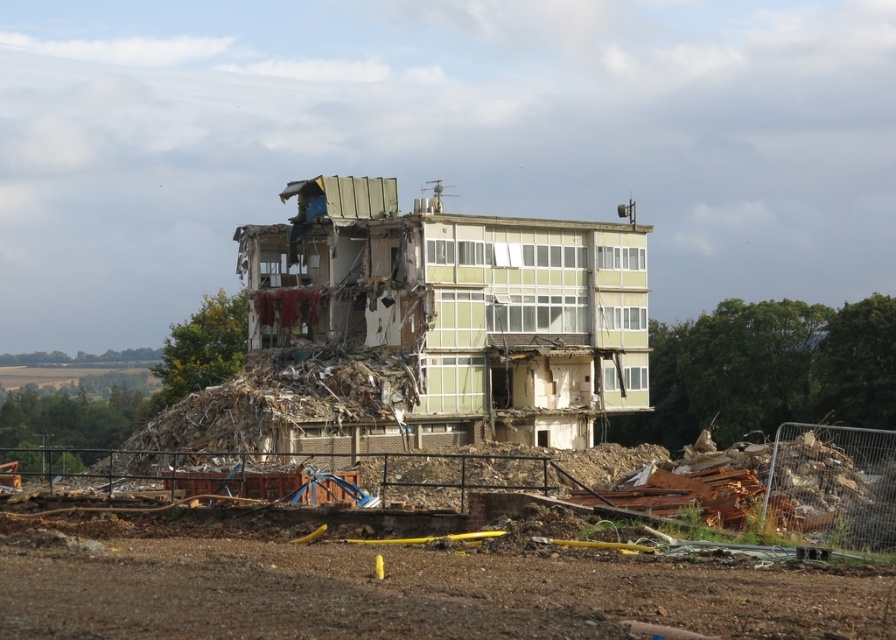
You are standing outside the demolition site and want to safely observe the green concrete building at center from a distance. According to safety guidelines, you must stay at least 20 meters away from any demolition site to avoid falling debris. Are you currently within the safe distance?

The green concrete building at center and viewer are 16.44 meters apart. Since the required safe distance is 20 meters, you are currently 3.56 meters too close and need to move back further to ensure safety.

You are standing at the demolition site and want to retrieve the rusty metal debris at center for recycling. Considering safety, what is the minimum safe distance you should maintain from the debris?

The rusty metal debris at center is 16.02 meters away from the viewer. To ensure safety, you should maintain a distance of at least 16.02 meters or more from the debris.